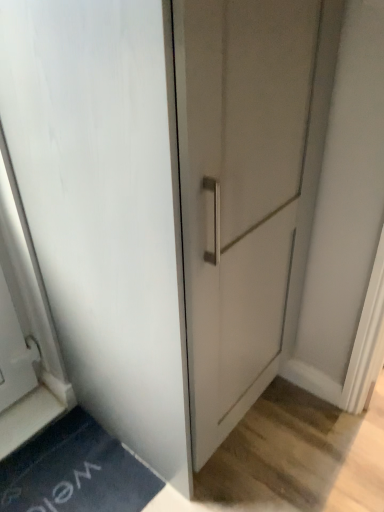
What are the coordinates of `dark blue rubber bath mat at lower left` in the screenshot? It's located at (75, 472).

The height and width of the screenshot is (512, 384). Describe the element at coordinates (75, 472) in the screenshot. I see `dark blue rubber bath mat at lower left` at that location.

You are a GUI agent. You are given a task and a screenshot of the screen. Output one action in this format:
    pyautogui.click(x=<x>, y=<y>)
    Task: Click on the white matte door at center
    The height and width of the screenshot is (512, 384).
    Given the screenshot: What is the action you would take?
    pyautogui.click(x=105, y=207)

What do you see at coordinates (105, 207) in the screenshot?
I see `white matte door at center` at bounding box center [105, 207].

This screenshot has width=384, height=512. In order to click on dark blue rubber bath mat at lower left in this screenshot , I will do `click(75, 472)`.

Which is more to the left, white matte door at center or dark blue rubber bath mat at lower left?

dark blue rubber bath mat at lower left is more to the left.

Is white matte door at center positioned behind dark blue rubber bath mat at lower left?

No, white matte door at center is in front of dark blue rubber bath mat at lower left.

Is point (107, 130) farther from camera compared to point (108, 444)?

No.

From the image's perspective, is white matte door at center on top of dark blue rubber bath mat at lower left?

Yes, from the image's perspective, white matte door at center is on top of dark blue rubber bath mat at lower left.

From a real-world perspective, is white matte door at center under dark blue rubber bath mat at lower left?

No, from a real-world perspective, white matte door at center is not beneath dark blue rubber bath mat at lower left.

Between white matte door at center and dark blue rubber bath mat at lower left, which one has larger width?

white matte door at center.

Considering the sizes of objects white matte door at center and dark blue rubber bath mat at lower left in the image provided, who is shorter, white matte door at center or dark blue rubber bath mat at lower left?

Standing shorter between the two is dark blue rubber bath mat at lower left.

Can you confirm if white matte door at center is smaller than dark blue rubber bath mat at lower left?

No.

Could dark blue rubber bath mat at lower left be considered to be inside white matte door at center?

No, dark blue rubber bath mat at lower left is not inside white matte door at center.

Is white matte door at center positioned far away from dark blue rubber bath mat at lower left?

No, white matte door at center is not far away from dark blue rubber bath mat at lower left.

Does white matte door at center turn towards dark blue rubber bath mat at lower left?

No, white matte door at center is not aimed at dark blue rubber bath mat at lower left.

How distant is white matte door at center from dark blue rubber bath mat at lower left?

The distance of white matte door at center from dark blue rubber bath mat at lower left is 21.87 inches.

In order to click on door that appears above the dark blue rubber bath mat at lower left (from a real-world perspective) in this screenshot , I will do `click(105, 207)`.

Does dark blue rubber bath mat at lower left appear on the right side of white matte door at center?

Incorrect, dark blue rubber bath mat at lower left is not on the right side of white matte door at center.

Is the position of dark blue rubber bath mat at lower left more distant than that of white matte door at center?

Yes, dark blue rubber bath mat at lower left is behind white matte door at center.

Which is in front, point (100, 471) or point (119, 193)?

The point (119, 193) is more forward.

From the image's perspective, is dark blue rubber bath mat at lower left above white matte door at center?

No, from the image's perspective, dark blue rubber bath mat at lower left is not above white matte door at center.

From a real-world perspective, between dark blue rubber bath mat at lower left and white matte door at center, who is vertically higher?

white matte door at center is physically above.

Is dark blue rubber bath mat at lower left wider than white matte door at center?

No.

Is dark blue rubber bath mat at lower left shorter than white matte door at center?

Yes, dark blue rubber bath mat at lower left is shorter than white matte door at center.

Between dark blue rubber bath mat at lower left and white matte door at center, which one has larger size?

white matte door at center is bigger.

Can white matte door at center be found inside dark blue rubber bath mat at lower left?

Definitely not — white matte door at center is not inside dark blue rubber bath mat at lower left.

Is dark blue rubber bath mat at lower left not close to white matte door at center?

No.

Could you tell me if dark blue rubber bath mat at lower left is turned towards white matte door at center?

No.

Measure the distance from dark blue rubber bath mat at lower left to white matte door at center.

dark blue rubber bath mat at lower left is 21.87 inches away from white matte door at center.

Find the location of a particular element. bath mat that is under the white matte door at center (from a real-world perspective) is located at coordinates (75, 472).

In the image, there is a white matte door at center. In order to click on bath mat below it (from a real-world perspective) in this screenshot , I will do `click(75, 472)`.

Where is `bath mat behind the white matte door at center`? bath mat behind the white matte door at center is located at coordinates (75, 472).